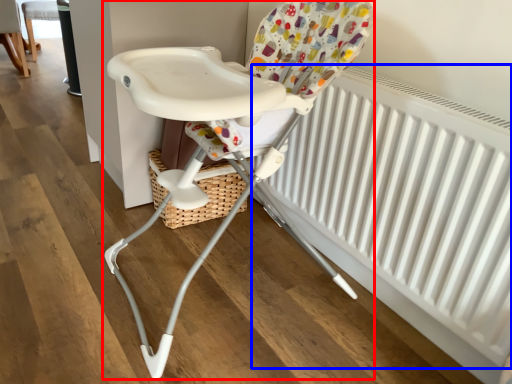
Question: Which object appears closest to the camera in this image, chair (highlighted by a red box) or radiator (highlighted by a blue box)?

Choices:
 (A) chair
 (B) radiator

Answer: (A)